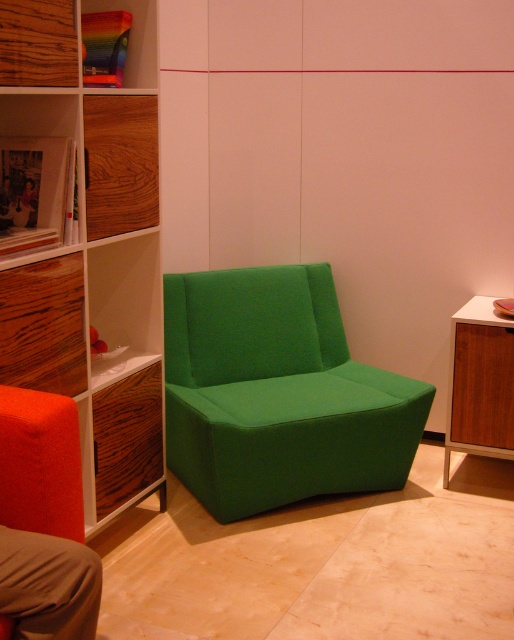
You are arranging a small coffee table between the green fabric armchair at center and the matte orange cushion at lower left. If the coffee table must fit snugly between them without touching either, what should you consider about their sizes?

The green fabric armchair at center is wider than the matte orange cushion at lower left. Therefore, the coffee table should be placed closer to the narrower matte orange cushion at lower left to ensure sufficient space between the wider armchair and the cushion.

You are sitting on the green fabric armchair at center and want to place a book on the matte orange cushion at lower left. Can you reach it without moving from your current position?

The green fabric armchair at center is positioned over matte orange cushion at lower left, so you are already sitting directly above the cushion. You can easily reach down to place the book on the matte orange cushion at lower left without needing to move.